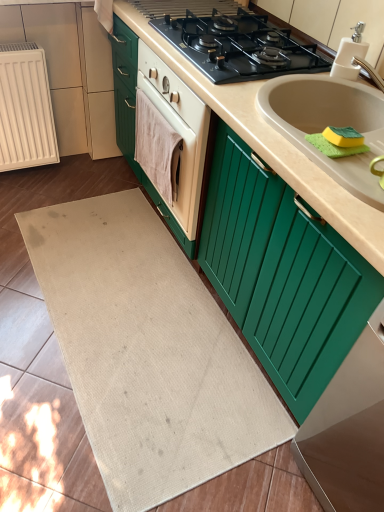
You are a GUI agent. You are given a task and a screenshot of the screen. Output one action in this format:
    pyautogui.click(x=<x>, y=<y>)
    Task: Click on the vacant area on top of beige fabric bath mat at center (from a real-world perspective)
    The height and width of the screenshot is (512, 384).
    Given the screenshot: What is the action you would take?
    pyautogui.click(x=135, y=312)